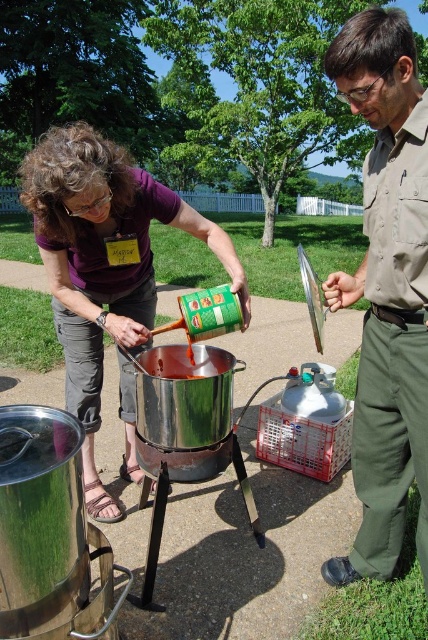
Question: Can you confirm if brown uniform at center is positioned above matte purple shirt at center?

Choices:
 (A) no
 (B) yes

Answer: (A)

Question: Which point is farther from the camera taking this photo?

Choices:
 (A) (392, 13)
 (B) (149, 298)

Answer: (B)

Question: Which point is closer to the camera?

Choices:
 (A) (148, 312)
 (B) (356, 432)

Answer: (B)

Question: Can you confirm if brown uniform at center is positioned above matte purple shirt at center?

Choices:
 (A) yes
 (B) no

Answer: (B)

Question: Observing the image, what is the correct spatial positioning of brown uniform at center in reference to matte purple shirt at center?

Choices:
 (A) left
 (B) right

Answer: (B)

Question: Which point is closer to the camera?

Choices:
 (A) (56, 141)
 (B) (326, 60)

Answer: (B)